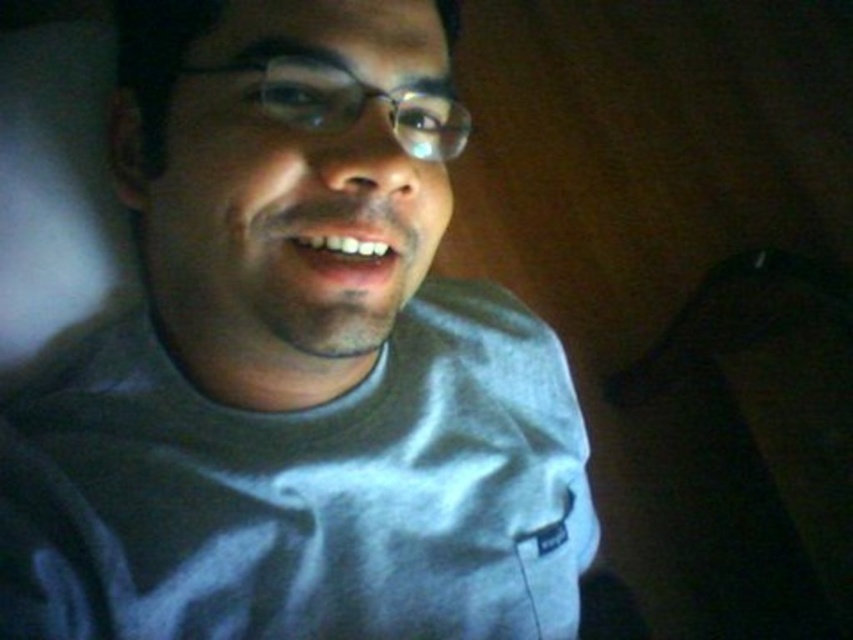
Can you confirm if gray cotton shirt at center is positioned above black fabric at lower right?

Yes.

Is point (380, 145) closer to camera compared to point (730, 592)?

Yes, it is.

This screenshot has width=853, height=640. Identify the location of gray cotton shirt at center. (296, 362).